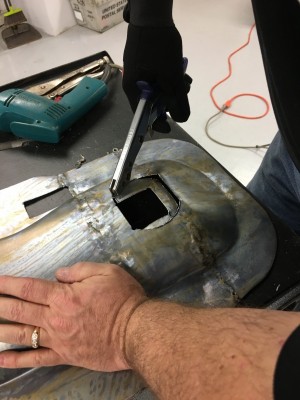
At what (x,y) coordinates should I click in order to perform the action: click on metal frame. Please return your answer as a coordinate pair (x, y). Image resolution: width=300 pixels, height=400 pixels. Looking at the image, I should click on (208, 229), (60, 234).